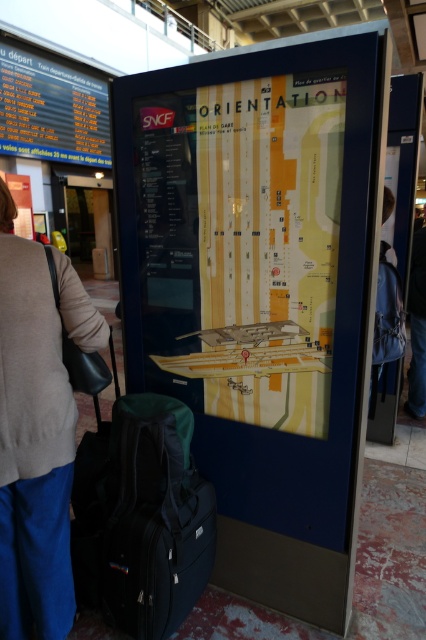
The width and height of the screenshot is (426, 640). What do you see at coordinates (32, 444) in the screenshot?
I see `light beige sweater at center` at bounding box center [32, 444].

From the picture: Who is more distant from viewer, (x=65, y=531) or (x=98, y=451)?

Point (x=98, y=451)

You are a GUI agent. You are given a task and a screenshot of the screen. Output one action in this format:
    pyautogui.click(x=<x>, y=<y>)
    Task: Click on the light beige sweater at center
    This screenshot has width=426, height=640.
    Given the screenshot: What is the action you would take?
    pyautogui.click(x=32, y=444)

The height and width of the screenshot is (640, 426). I want to click on light beige sweater at center, so click(x=32, y=444).

Between point (299, 83) and point (196, 554), which one is positioned behind?

The point (196, 554) is more distant.

Who is positioned more to the right, yellow paper map at center or black fabric suitcase at lower left?

yellow paper map at center is more to the right.

Between point (190, 234) and point (109, 456), which one is positioned in front?

Point (109, 456) is in front.

This screenshot has width=426, height=640. I want to click on yellow paper map at center, so click(x=242, y=244).

Which is above, yellow paper map at center or light beige sweater at center?

yellow paper map at center is higher up.

Who is positioned more to the right, yellow paper map at center or light beige sweater at center?

From the viewer's perspective, yellow paper map at center appears more on the right side.

Image resolution: width=426 pixels, height=640 pixels. Find the location of `yellow paper map at center`. yellow paper map at center is located at coordinates (242, 244).